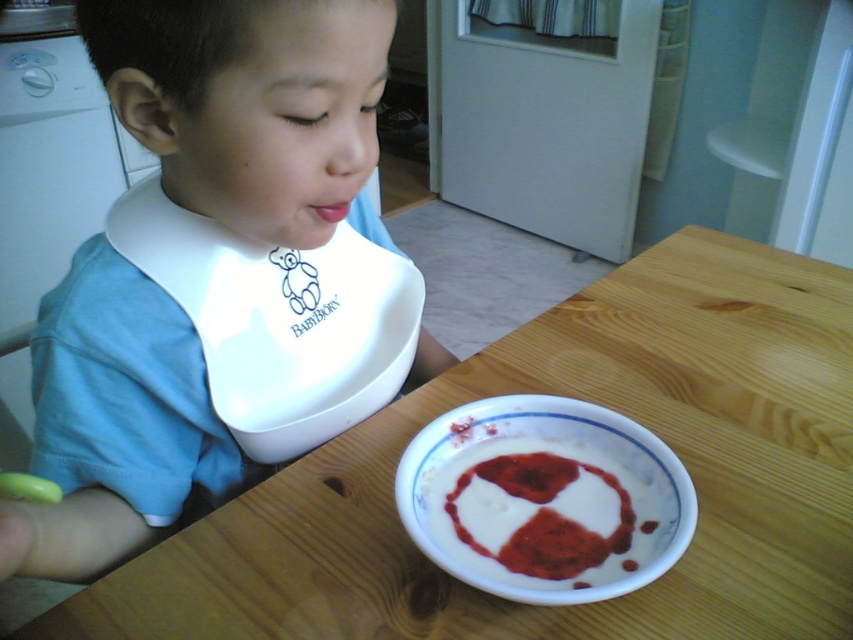
You are a parent preparing to feed your child. You have a wooden table at center and a white glossy bowl at lower center. Which object is higher in height?

The wooden table at center is taller than the white glossy bowl at lower center according to the description.

Consider the image. You are a parent trying to decide where to place a new toy for your child. The wooden table at center is where the child eats, and the white plastic bib at upper left is near their usual eating spot. Considering their size, which object would be more suitable for placing the toy so it doesn

The wooden table at center is larger in size than the white plastic bib at upper left, so the wooden table at center would provide a more stable and appropriate surface for placing the toy.

You are a parent trying to ensure your child eats their food. The white plastic bib at upper left and the white creamy food at lower center are in the scene. Which object is positioned higher from the ground?

The white plastic bib at upper left is located above the white creamy food at lower center, so it is positioned higher from the ground.